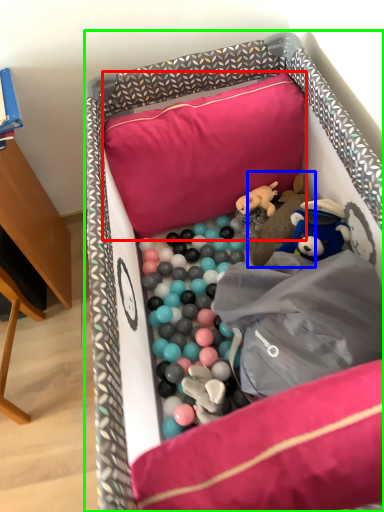
Question: Which object is positioned closest to pillow (highlighted by a red box)? Select from toy (highlighted by a blue box) and infant bed (highlighted by a green box).

Choices:
 (A) toy
 (B) infant bed

Answer: (B)